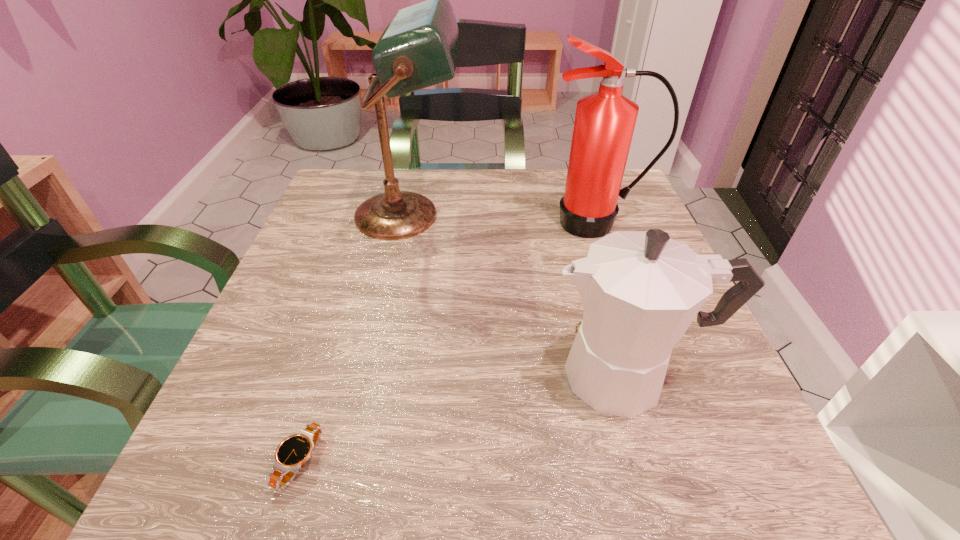
The height and width of the screenshot is (540, 960). Identify the location of object that is at the near left corner. (291, 454).

You are a GUI agent. You are given a task and a screenshot of the screen. Output one action in this format:
    pyautogui.click(x=<x>, y=<y>)
    Task: Click on the object that is at the far right corner
    This screenshot has width=960, height=540.
    Given the screenshot: What is the action you would take?
    pyautogui.click(x=604, y=124)

You are a GUI agent. You are given a task and a screenshot of the screen. Output one action in this format:
    pyautogui.click(x=<x>, y=<y>)
    Task: Click on the free region at the far edge
    
    Given the screenshot: What is the action you would take?
    pyautogui.click(x=502, y=178)

The image size is (960, 540). In the image, there is a desktop. Find the location of `blank space at the left edge`. blank space at the left edge is located at coordinates (245, 383).

This screenshot has height=540, width=960. In order to click on vacant space at the right edge of the desktop in this screenshot , I will do `click(669, 424)`.

This screenshot has width=960, height=540. In the image, there is a desktop. Identify the location of free region at the far left corner. (352, 197).

Locate an element on the screen. vacant space at the near left corner is located at coordinates (226, 498).

Image resolution: width=960 pixels, height=540 pixels. In the image, there is a desktop. What are the coordinates of `vacant space at the far right corner` in the screenshot? It's located at (638, 219).

Find the location of `free point between the table lamp and the shortest object`. free point between the table lamp and the shortest object is located at coordinates (354, 339).

Find the location of a particular element. free area in between the table lamp and the third tallest object is located at coordinates (518, 295).